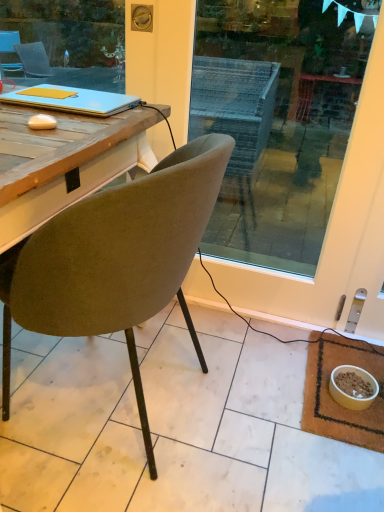
Question: From a real-world perspective, is velvet olive chair at center above or below brown woven mat at lower right?

Choices:
 (A) above
 (B) below

Answer: (A)

Question: Is velvet olive chair at center taller or shorter than brown woven mat at lower right?

Choices:
 (A) short
 (B) tall

Answer: (B)

Question: Which is nearer to the matte blue laptop at upper left?

Choices:
 (A) yellow matte bowl at lower right
 (B) brown woven mat at lower right
 (C) velvet olive chair at center

Answer: (C)

Question: Based on their relative distances, which object is nearer to the matte blue laptop at upper left?

Choices:
 (A) velvet olive chair at center
 (B) brown woven mat at lower right
 (C) yellow matte bowl at lower right

Answer: (A)